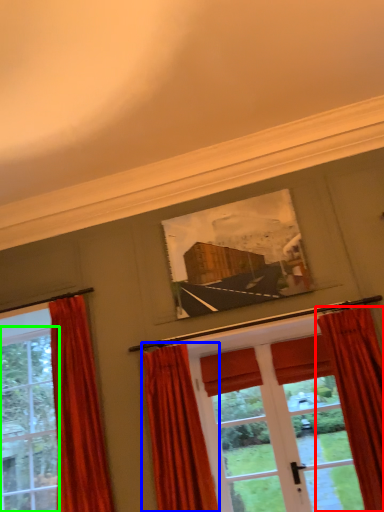
Question: Estimate the real-world distances between objects in this image. Which object is farther from curtain (highlighted by a red box), curtain (highlighted by a blue box) or window (highlighted by a green box)?

Choices:
 (A) curtain
 (B) window

Answer: (B)